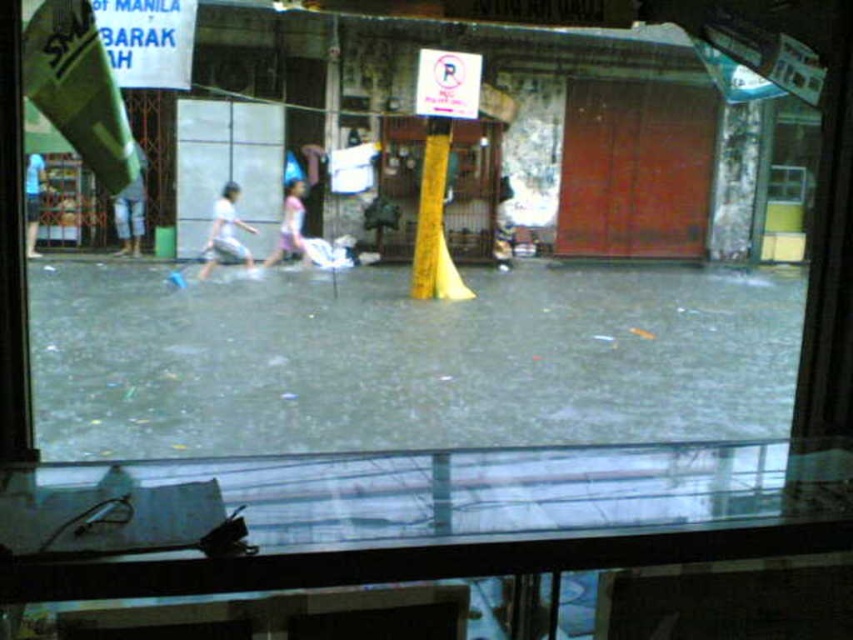
Question: Which of the following is the closest to the observer?

Choices:
 (A) (418, 291)
 (B) (32, 195)
 (C) (233, 228)
 (D) (604, 326)

Answer: (D)

Question: Which point appears closest to the camera in this image?

Choices:
 (A) (39, 204)
 (B) (659, 364)

Answer: (B)

Question: Does gray matte flood at center appear on the right side of white paper sign at upper center?

Choices:
 (A) yes
 (B) no

Answer: (A)

Question: Is white cotton pants at left to the right of light blue t-shirt at left from the viewer's perspective?

Choices:
 (A) yes
 (B) no

Answer: (A)

Question: Can you confirm if pink fabric pants at center is positioned to the right of light blue t-shirt at left?

Choices:
 (A) no
 (B) yes

Answer: (B)

Question: Among these points, which one is nearest to the camera?

Choices:
 (A) (283, 225)
 (B) (231, 198)

Answer: (B)